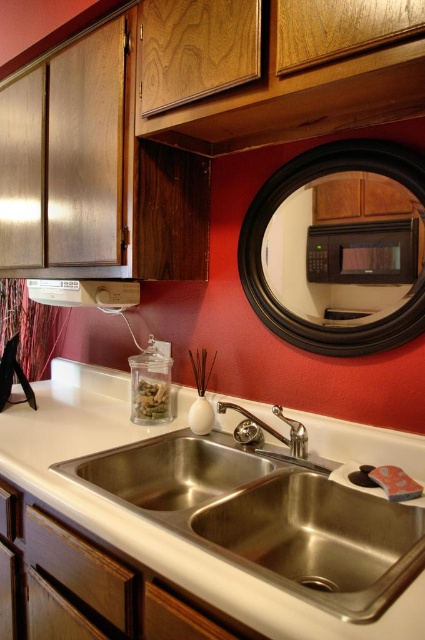
Is point (413, 248) in front of point (283, 413)?

Yes, point (413, 248) is closer to viewer.

Which is above, black matte microwave at upper center or polished chrome faucet at center?

black matte microwave at upper center

What do you see at coordinates (362, 252) in the screenshot? The image size is (425, 640). I see `black matte microwave at upper center` at bounding box center [362, 252].

Where is `black matte microwave at upper center`? black matte microwave at upper center is located at coordinates (362, 252).

Does point (255, 248) lie behind point (377, 248)?

Yes, point (255, 248) is farther from viewer.

Where is `black framed mirror at upper center`? Image resolution: width=425 pixels, height=640 pixels. black framed mirror at upper center is located at coordinates (277, 208).

This screenshot has height=640, width=425. I want to click on black framed mirror at upper center, so click(x=277, y=208).

Which of these two, white glossy countertop at center or black matte microwave at upper center, stands taller?

With more height is white glossy countertop at center.

Can you confirm if white glossy countertop at center is thinner than black matte microwave at upper center?

In fact, white glossy countertop at center might be wider than black matte microwave at upper center.

This screenshot has height=640, width=425. Find the location of `white glossy countertop at center`. white glossy countertop at center is located at coordinates (147, 518).

Identify the location of white glossy countertop at center. (147, 518).